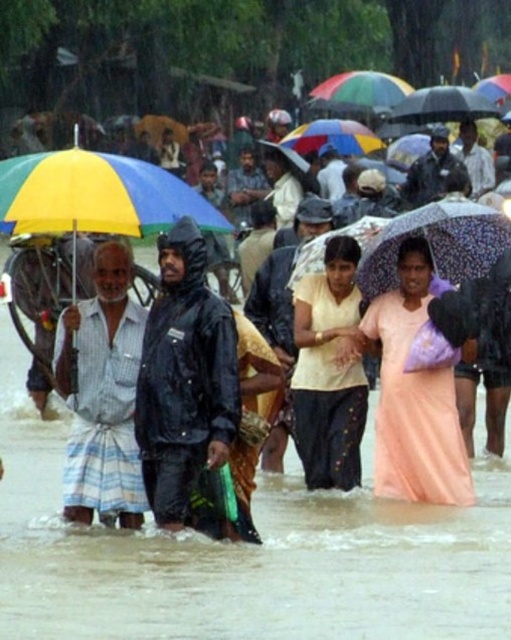
Question: Which point is closer to the camera taking this photo?

Choices:
 (A) (212, 348)
 (B) (296, 336)
 (C) (108, 173)

Answer: (C)

Question: Does yellowmatteumbrella at left lie in front of yellow matte shirt at center?

Choices:
 (A) no
 (B) yes

Answer: (B)

Question: Which point appears closest to the camera in this image?

Choices:
 (A) (155, 474)
 (B) (453, 504)

Answer: (A)

Question: From the image, what is the correct spatial relationship of black matte raincoat at center in relation to pink satin dress at center?

Choices:
 (A) above
 (B) below

Answer: (A)

Question: Among these objects, which one is nearest to the camera?

Choices:
 (A) yellowmatteumbrella at left
 (B) black matte raincoat at center

Answer: (A)

Question: Is the position of striped fabric dhoti at left more distant than that of yellowmatteumbrella at left?

Choices:
 (A) yes
 (B) no

Answer: (A)